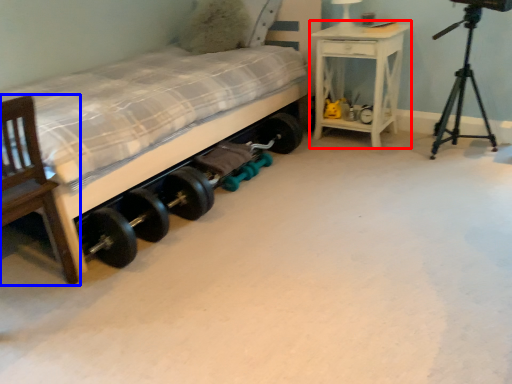
Question: Which of the following is the closest to the observer, nightstand (highlighted by a red box) or chair (highlighted by a blue box)?

Choices:
 (A) nightstand
 (B) chair

Answer: (B)